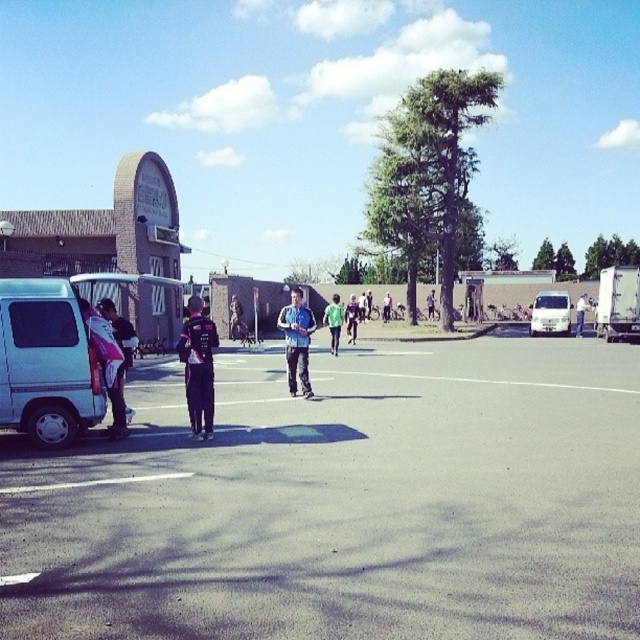
You are a delivery person who needs to place a large package on the ground. The package is as wide as the light blue fabric jacket at center. Can you safely place it on the black asphalt parking lot at center without exceeding its width?

The black asphalt parking lot at center is wider than the light blue fabric jacket at center, so yes, the package can be safely placed there as it won not exceed the parking lot width.

You are standing at the entrance of the building and want to park your car in the closest available spot. According to the image, where is the black asphalt parking lot at center located?

The black asphalt parking lot at center is located at point (346,502).